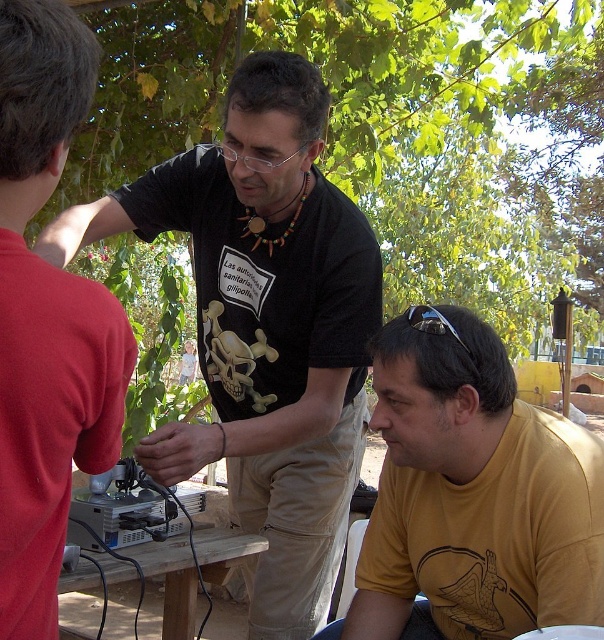
Based on the coordinates provided in the scene, can you identify which object or feature is located at point (47, 317)?

The point (47, 317) corresponds to the matte black shirt at center.